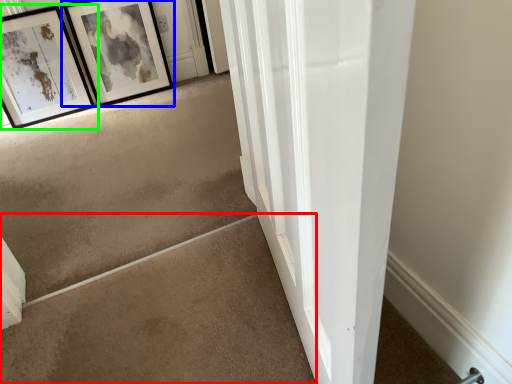
Question: Based on their relative distances, which object is nearer to concrete (highlighted by a red box)? Choose from picture frame (highlighted by a blue box) and picture frame (highlighted by a green box).

Choices:
 (A) picture frame
 (B) picture frame

Answer: (B)